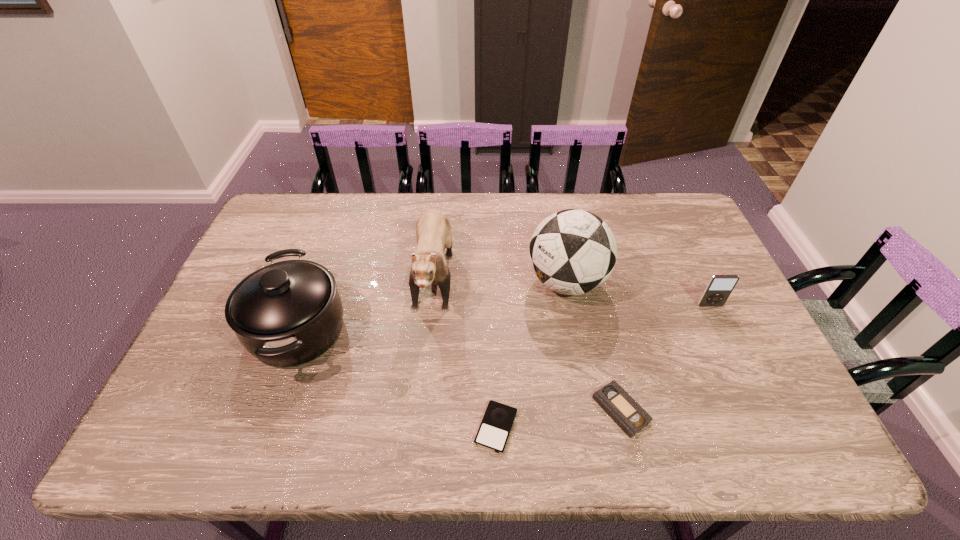
Locate an element on the screen. vacant space located on the surface of the soccer ball where the brand logo is visible is located at coordinates (487, 282).

Identify the location of free location located 0.320m on the face of the ferret. click(416, 445).

Identify the location of free location located on the back of the saucepan. This screenshot has height=540, width=960. (339, 215).

Where is `vacant space situated 0.230m on the front-facing side of the taller iPod`? This screenshot has width=960, height=540. vacant space situated 0.230m on the front-facing side of the taller iPod is located at coordinates (744, 376).

In order to click on free space located on the back of the videotape in this screenshot , I will do `click(602, 329)`.

This screenshot has height=540, width=960. Find the location of `vacant position located 0.090m on the left of the shorter iPod`. vacant position located 0.090m on the left of the shorter iPod is located at coordinates (435, 427).

You are a GUI agent. You are given a task and a screenshot of the screen. Output one action in this format:
    pyautogui.click(x=<x>, y=<y>)
    Task: Click on the object that is at the far edge
    The height and width of the screenshot is (540, 960).
    Given the screenshot: What is the action you would take?
    pyautogui.click(x=433, y=230)

Locate an element on the screen. videotape at the near edge is located at coordinates (613, 399).

Identify the location of iPod that is positioned at the near edge. The image size is (960, 540). [x=493, y=433].

This screenshot has height=540, width=960. In order to click on object located at the left edge in this screenshot , I will do `click(288, 313)`.